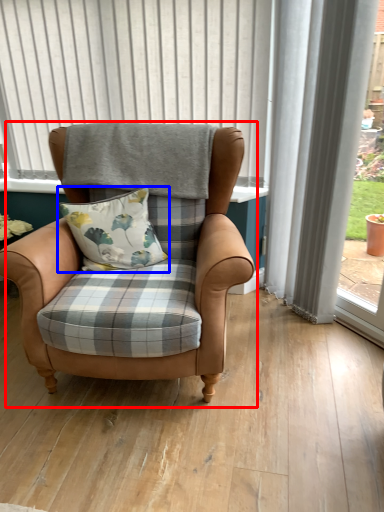
Question: Among these objects, which one is farthest to the camera, chair (highlighted by a red box) or pillow (highlighted by a blue box)?

Choices:
 (A) chair
 (B) pillow

Answer: (B)